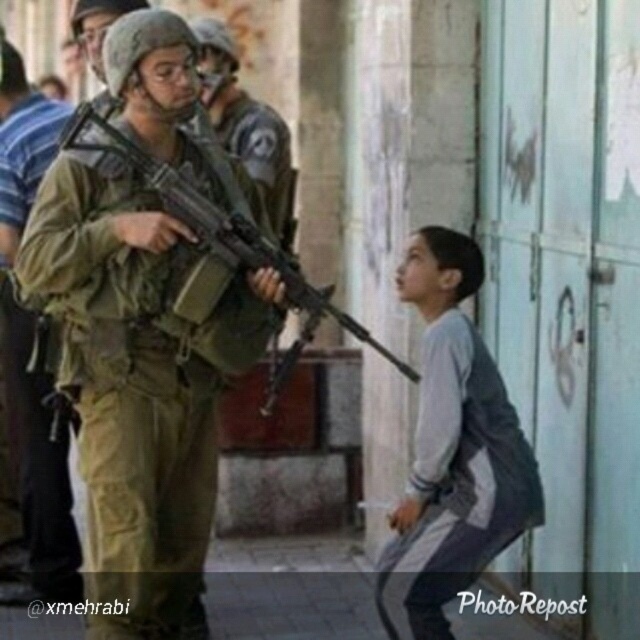
You are a photographer trying to capture a clear shot of both the gray fabric pants at lower right and the camouflage uniform at center. Since you can only focus on one subject at a time, which one should you choose to ensure the other is still somewhat in focus?

The gray fabric pants at lower right is closer to the viewer than the camouflage uniform at center. To ensure the other is somewhat in focus, you should focus on the camouflage uniform at center because it is farther away, allowing the closer gray fabric pants at lower right to be within the depth of field.

In the urban scene described, there are two individuals wearing camouflage uniforms. The camouflage fabric uniform at left and the camouflage uniform at center. From the perspective of someone standing behind the soldier, which camouflage uniform is positioned to the right?

The camouflage fabric uniform at left is positioned to the right of the camouflage uniform at center, so from the perspective of someone standing behind the soldier, the camouflage fabric uniform at left would be on the right side.

You are a photographer positioned to the right of the scene. You want to take a photo of both the camouflage fabric uniform at left and the camouflage uniform at center. However, you notice that one is blocking the view of the other. Which uniform is currently blocking the other?

The camouflage fabric uniform at left is in front of camouflage uniform at center, so it is blocking the view of the camouflage uniform at center.